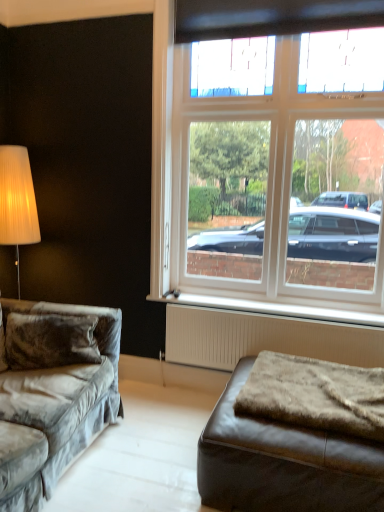
Locate an element on the screen. The image size is (384, 512). vacant space underneath white glass window at center (from a real-world perspective) is located at coordinates (273, 305).